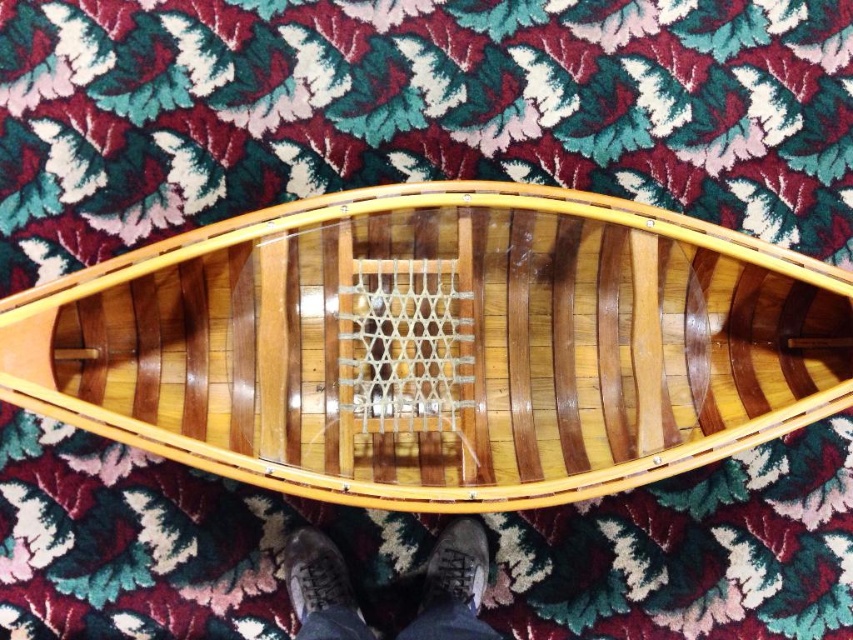
Between brown leather shoes at lower center and brown leather shoe at lower center, which one is positioned lower?

brown leather shoes at lower center

Does brown leather shoes at lower center have a smaller size compared to brown leather shoe at lower center?

No, brown leather shoes at lower center is not smaller than brown leather shoe at lower center.

Describe the element at coordinates (454, 586) in the screenshot. I see `brown leather shoes at lower center` at that location.

The image size is (853, 640). I want to click on brown leather shoes at lower center, so click(454, 586).

At what (x,y) coordinates should I click in order to perform the action: click on wooden boat at center. Please return your answer as a coordinate pair (x, y). Image resolution: width=853 pixels, height=640 pixels. Looking at the image, I should click on (439, 346).

Describe the element at coordinates (439, 346) in the screenshot. I see `wooden boat at center` at that location.

This screenshot has height=640, width=853. In order to click on wooden boat at center in this screenshot , I will do `click(439, 346)`.

What are the coordinates of `wooden boat at center` in the screenshot? It's located at (439, 346).

Who is positioned more to the right, wooden boat at center or brown leather shoe at lower center?

wooden boat at center is more to the right.

Who is positioned more to the left, wooden boat at center or brown leather shoe at lower center?

Positioned to the left is brown leather shoe at lower center.

Is point (408, 218) more distant than point (343, 561)?

No, (408, 218) is closer to viewer.

Where is `wooden boat at center`? Image resolution: width=853 pixels, height=640 pixels. wooden boat at center is located at coordinates (439, 346).